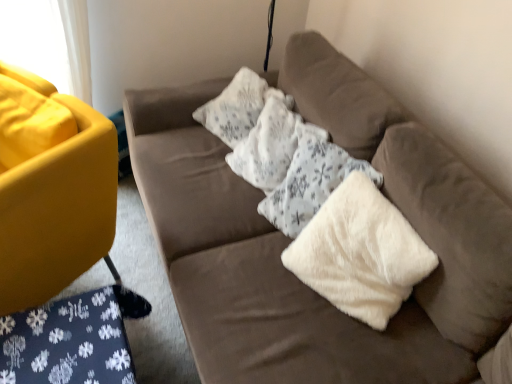
Question: Is velvet brown couch at center, which is the 2th studio couch from left to right, outside white fluffy pillow at center?

Choices:
 (A) yes
 (B) no

Answer: (A)

Question: Considering the relative positions of velvet brown couch at center, arranged as the 1th studio couch when viewed from the right, and white fluffy pillow at center in the image provided, is velvet brown couch at center, arranged as the 1th studio couch when viewed from the right, to the left of white fluffy pillow at center from the viewer's perspective?

Choices:
 (A) yes
 (B) no

Answer: (B)

Question: From a real-world perspective, is velvet brown couch at center, arranged as the 1th studio couch when viewed from the right, beneath white fluffy pillow at center?

Choices:
 (A) no
 (B) yes

Answer: (B)

Question: Does velvet brown couch at center, which is the 2th studio couch from left to right, lie behind white fluffy pillow at center?

Choices:
 (A) no
 (B) yes

Answer: (A)

Question: Is velvet brown couch at center, arranged as the 1th studio couch when viewed from the right, turned away from white fluffy pillow at center?

Choices:
 (A) yes
 (B) no

Answer: (A)

Question: Is velvet brown couch at center, which is the 2th studio couch from left to right, thinner than white fluffy pillow at center?

Choices:
 (A) no
 (B) yes

Answer: (A)

Question: Is white fluffy pillow at center at the back of velvet brown couch at center, arranged as the 1th studio couch when viewed from the right?

Choices:
 (A) yes
 (B) no

Answer: (A)

Question: Considering the relative sizes of velvet brown couch at center, arranged as the 1th studio couch when viewed from the right, and white fluffy pillow at center in the image provided, is velvet brown couch at center, arranged as the 1th studio couch when viewed from the right, smaller than white fluffy pillow at center?

Choices:
 (A) no
 (B) yes

Answer: (A)

Question: From the image's perspective, would you say velvet brown couch at center, which is the 2th studio couch from left to right, is shown under white fluffy pillow at center?

Choices:
 (A) yes
 (B) no

Answer: (B)

Question: Does velvet brown couch at center, arranged as the 1th studio couch when viewed from the right, have a greater height compared to white fluffy pillow at center?

Choices:
 (A) yes
 (B) no

Answer: (A)

Question: Is velvet brown couch at center, which is the 2th studio couch from left to right, not close to white fluffy pillow at center?

Choices:
 (A) no
 (B) yes

Answer: (A)

Question: Does velvet brown couch at center, which is the 2th studio couch from left to right, come in front of white fluffy pillow at center?

Choices:
 (A) no
 (B) yes

Answer: (B)

Question: Considering the relative sizes of matte yellow couch at left, which is the 1th studio couch from left to right, and white fluffy pillow at center in the image provided, is matte yellow couch at left, which is the 1th studio couch from left to right, taller than white fluffy pillow at center?

Choices:
 (A) yes
 (B) no

Answer: (A)